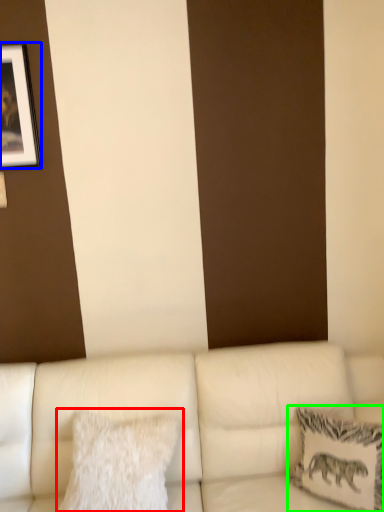
Question: Estimate the real-world distances between objects in this image. Which object is farther from pillow (highlighted by a red box), picture frame (highlighted by a blue box) or pillow (highlighted by a green box)?

Choices:
 (A) picture frame
 (B) pillow

Answer: (A)